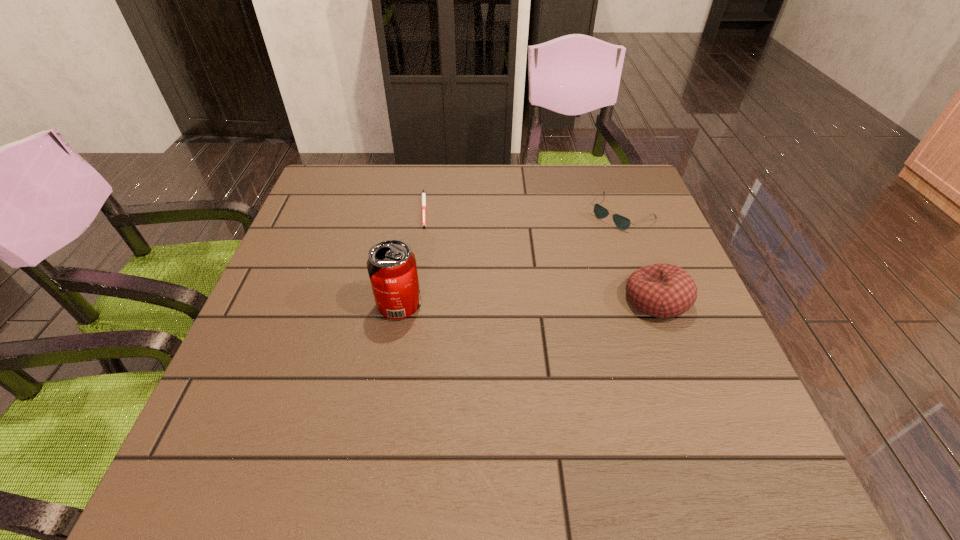
Identify the location of blank area at the right edge. (677, 348).

This screenshot has height=540, width=960. I want to click on free space at the far left corner of the desktop, so click(x=331, y=187).

Find the location of a particular element. The width and height of the screenshot is (960, 540). free space at the far right corner of the desktop is located at coordinates (625, 192).

Where is `unoccupied position between the beanbag and the second shortest object`? unoccupied position between the beanbag and the second shortest object is located at coordinates (639, 256).

Locate an element on the screen. The height and width of the screenshot is (540, 960). free space between the pen and the beanbag is located at coordinates (540, 254).

The height and width of the screenshot is (540, 960). In order to click on free space that is in between the second tallest object and the pen in this screenshot , I will do `click(540, 254)`.

Identify the location of unoccupied area between the third shortest object and the pen. The image size is (960, 540). (540, 254).

At what (x,y) coordinates should I click in order to perform the action: click on free spot between the sunglasses and the shortest object. Please return your answer as a coordinate pair (x, y). This screenshot has height=540, width=960. Looking at the image, I should click on (523, 211).

Identify the location of vacant space that's between the sunglasses and the third shortest object. (639, 256).

You are a GUI agent. You are given a task and a screenshot of the screen. Output one action in this format:
    pyautogui.click(x=<x>, y=<y>)
    Task: Click on the unoccupied position between the second tallest object and the pen
    The width and height of the screenshot is (960, 540).
    Given the screenshot: What is the action you would take?
    pyautogui.click(x=540, y=254)